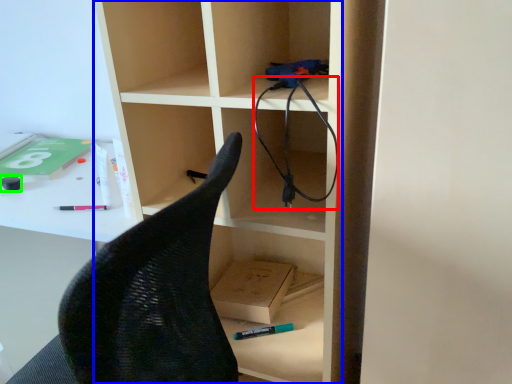
Question: Considering the real-world distances, which object is farthest from cable (highlighted by a red box)? bookshelf (highlighted by a blue box) or stationery (highlighted by a green box)?

Choices:
 (A) bookshelf
 (B) stationery

Answer: (B)